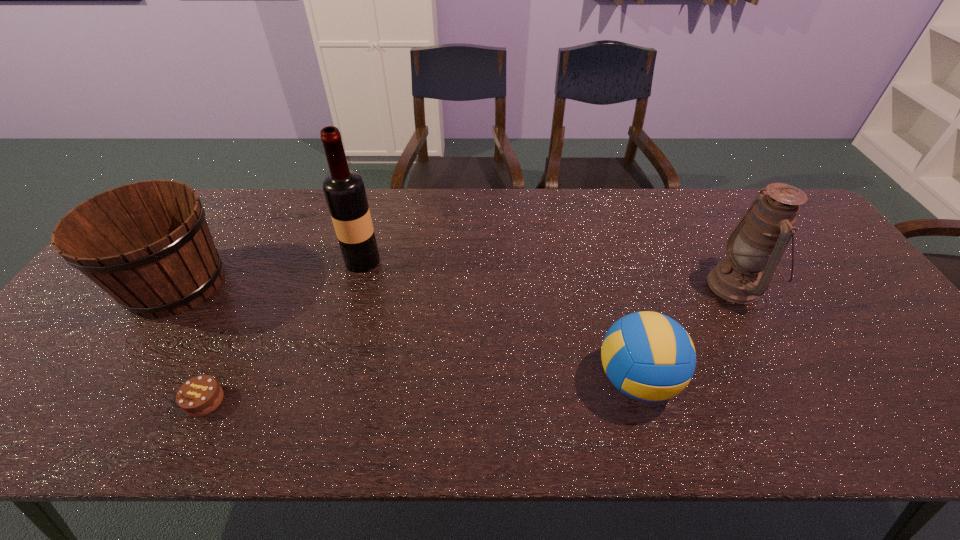
Where is `vacant region between the wine bottle and the third shortest object`? This screenshot has height=540, width=960. vacant region between the wine bottle and the third shortest object is located at coordinates (269, 272).

What are the coordinates of `object that is the fourth closest one to the oil lamp` in the screenshot? It's located at point(148,245).

Point out which object is positioned as the nearest to the fourth object from left to right. Please provide its 2D coordinates. Your answer should be formatted as a tuple, i.e. [(x, y)], where the tuple contains the x and y coordinates of a point satisfying the conditions above.

[(760, 239)]